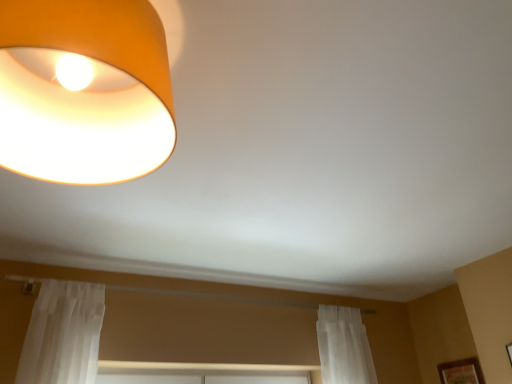
Describe the element at coordinates (84, 90) in the screenshot. I see `matte orange lampshade at upper left` at that location.

At what (x,y) coordinates should I click in order to perform the action: click on matte orange lampshade at upper left. Please return your answer as a coordinate pair (x, y). Looking at the image, I should click on [84, 90].

Where is `wooden framed picture at lower right`? This screenshot has height=384, width=512. wooden framed picture at lower right is located at coordinates (461, 372).

What do you see at coordinates (461, 372) in the screenshot?
I see `wooden framed picture at lower right` at bounding box center [461, 372].

Where is `matte orange lampshade at upper left`? This screenshot has width=512, height=384. matte orange lampshade at upper left is located at coordinates (84, 90).

Visually, is matte orange lampshade at upper left positioned to the left or to the right of wooden framed picture at lower right?

matte orange lampshade at upper left is positioned on wooden framed picture at lower right's left side.

Does matte orange lampshade at upper left lie behind wooden framed picture at lower right?

No, it is not.

Is point (7, 42) positioned in front of point (458, 379)?

Yes, it is in front of point (458, 379).

From the image's perspective, would you say matte orange lampshade at upper left is shown under wooden framed picture at lower right?

Actually, matte orange lampshade at upper left appears above wooden framed picture at lower right in the image.

From a real-world perspective, is matte orange lampshade at upper left physically located above or below wooden framed picture at lower right?

In terms of real-world spatial position, matte orange lampshade at upper left is above wooden framed picture at lower right.

Which of these two, matte orange lampshade at upper left or wooden framed picture at lower right, is wider?

matte orange lampshade at upper left is wider.

Who is taller, matte orange lampshade at upper left or wooden framed picture at lower right?

With more height is wooden framed picture at lower right.

Can you confirm if matte orange lampshade at upper left is bigger than wooden framed picture at lower right?

Yes.

Is matte orange lampshade at upper left positioned beyond the bounds of wooden framed picture at lower right?

That's correct, matte orange lampshade at upper left is outside of wooden framed picture at lower right.

Is matte orange lampshade at upper left in contact with wooden framed picture at lower right?

They are not placed beside each other.

Is matte orange lampshade at upper left turned away from wooden framed picture at lower right?

No, wooden framed picture at lower right is not at the back of matte orange lampshade at upper left.

I want to click on lamp in front of the wooden framed picture at lower right, so click(84, 90).

Considering the relative positions of wooden framed picture at lower right and matte orange lampshade at upper left in the image provided, is wooden framed picture at lower right to the right of matte orange lampshade at upper left from the viewer's perspective?

Yes.

Which object is closer to the camera taking this photo, wooden framed picture at lower right or matte orange lampshade at upper left?

matte orange lampshade at upper left is closer to the camera.

Considering the positions of points (468, 373) and (7, 64), is point (468, 373) closer to camera compared to point (7, 64)?

No, it is behind (7, 64).

From the image's perspective, which one is positioned higher, wooden framed picture at lower right or matte orange lampshade at upper left?

matte orange lampshade at upper left is shown above in the image.

From a real-world perspective, is wooden framed picture at lower right physically above matte orange lampshade at upper left?

No.

Considering the relative sizes of wooden framed picture at lower right and matte orange lampshade at upper left in the image provided, is wooden framed picture at lower right wider than matte orange lampshade at upper left?

Incorrect, the width of wooden framed picture at lower right does not surpass that of matte orange lampshade at upper left.

Does wooden framed picture at lower right have a lesser height compared to matte orange lampshade at upper left?

Incorrect, the height of wooden framed picture at lower right does not fall short of that of matte orange lampshade at upper left.

Who is bigger, wooden framed picture at lower right or matte orange lampshade at upper left?

matte orange lampshade at upper left is bigger.

Is wooden framed picture at lower right inside the boundaries of matte orange lampshade at upper left, or outside?

wooden framed picture at lower right is outside matte orange lampshade at upper left.

From the picture: Would you say wooden framed picture at lower right is a long distance from matte orange lampshade at upper left?

wooden framed picture at lower right is far away from matte orange lampshade at upper left.

Does wooden framed picture at lower right turn towards matte orange lampshade at upper left?

No, wooden framed picture at lower right is not oriented towards matte orange lampshade at upper left.

Looking at this image, how different are the orientations of wooden framed picture at lower right and matte orange lampshade at upper left in degrees?

wooden framed picture at lower right and matte orange lampshade at upper left are facing 90 degrees away from each other.

Where is `lamp that appears above the wooden framed picture at lower right (from a real-world perspective)`? The image size is (512, 384). lamp that appears above the wooden framed picture at lower right (from a real-world perspective) is located at coordinates (84, 90).

Find the location of a particular element. picture frame below the matte orange lampshade at upper left (from the image's perspective) is located at coordinates (461, 372).

This screenshot has height=384, width=512. Find the location of `picture frame on the right of matte orange lampshade at upper left`. picture frame on the right of matte orange lampshade at upper left is located at coordinates (461, 372).